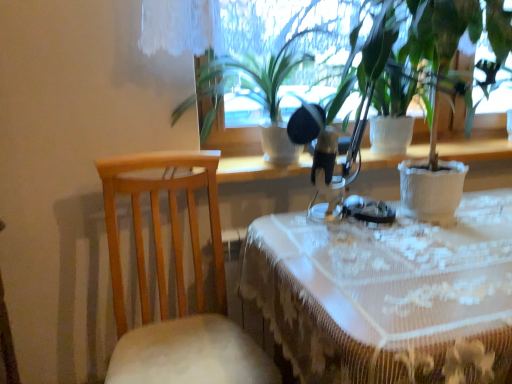
Describe the element at coordinates (400, 64) in the screenshot. Image resolution: width=512 pixels, height=384 pixels. I see `white textured pot at center, marked as the second houseplant in a left-to-right arrangement` at that location.

Where is `green matte plant at center, which appears as the 2th houseplant when viewed from the right`? The height and width of the screenshot is (384, 512). green matte plant at center, which appears as the 2th houseplant when viewed from the right is located at coordinates (278, 74).

This screenshot has width=512, height=384. In order to click on light wood chair at left in this screenshot , I will do `click(176, 284)`.

Is white textured pot at center, marked as the second houseplant in a left-to-right arrangement, positioned far away from light wood chair at left?

Actually, white textured pot at center, marked as the second houseplant in a left-to-right arrangement, and light wood chair at left are a little close together.

Identify the location of the 1st houseplant behind the light wood chair at left. (400, 64).

What's the angular difference between white textured pot at center, marked as the second houseplant in a left-to-right arrangement, and light wood chair at left's facing directions?

8.98 degrees.

From the image's perspective, relative to light wood chair at left, is white textured pot at center, marked as the second houseplant in a left-to-right arrangement, above or below?

white textured pot at center, marked as the second houseplant in a left-to-right arrangement, is situated higher than light wood chair at left in the image.

From a real-world perspective, is light wood chair at left beneath green matte plant at center, the 1th houseplant when ordered from left to right?

Indeed, from a real-world perspective, light wood chair at left is positioned beneath green matte plant at center, the 1th houseplant when ordered from left to right.

Could you tell me if light wood chair at left is facing green matte plant at center, the 1th houseplant when ordered from left to right?

No.

From the image's perspective, is light wood chair at left on green matte plant at center, which appears as the 2th houseplant when viewed from the right?

Actually, light wood chair at left appears below green matte plant at center, which appears as the 2th houseplant when viewed from the right, in the image.

Does light wood chair at left have a smaller size compared to green matte plant at center, the 1th houseplant when ordered from left to right?

No, light wood chair at left is not smaller than green matte plant at center, the 1th houseplant when ordered from left to right.

Considering the sizes of white textured pot at center, marked as the second houseplant in a left-to-right arrangement, and white lace tablecloth at center in the image, is white textured pot at center, marked as the second houseplant in a left-to-right arrangement, taller or shorter than white lace tablecloth at center?

→ Clearly, white textured pot at center, marked as the second houseplant in a left-to-right arrangement, is shorter compared to white lace tablecloth at center.

Is point (216, 77) in front of point (349, 233)?

No.

In the scene shown: Can you confirm if white textured pot at center, placed as the first houseplant when sorted from right to left, is positioned to the left of white lace tablecloth at center?

Indeed, white textured pot at center, placed as the first houseplant when sorted from right to left, is positioned on the left side of white lace tablecloth at center.

Does white textured pot at center, marked as the second houseplant in a left-to-right arrangement, have a larger size compared to white lace tablecloth at center?

No.

From a real-world perspective, is white lace tablecloth at center located beneath white textured pot at center, marked as the second houseplant in a left-to-right arrangement?

Yes, from a real-world perspective, white lace tablecloth at center is under white textured pot at center, marked as the second houseplant in a left-to-right arrangement.

Which is farther, (412,333) or (399,53)?

Point (399,53)

Considering the positions of objects white lace tablecloth at center and white textured pot at center, placed as the first houseplant when sorted from right to left, in the image provided, who is more to the right, white lace tablecloth at center or white textured pot at center, placed as the first houseplant when sorted from right to left,?

Positioned to the right is white lace tablecloth at center.

Considering the sizes of objects white lace tablecloth at center and white textured pot at center, marked as the second houseplant in a left-to-right arrangement, in the image provided, who is taller, white lace tablecloth at center or white textured pot at center, marked as the second houseplant in a left-to-right arrangement,?

With more height is white lace tablecloth at center.

Where is `chair in front of the green matte plant at center, the 1th houseplant when ordered from left to right`? This screenshot has height=384, width=512. chair in front of the green matte plant at center, the 1th houseplant when ordered from left to right is located at coordinates (176, 284).

From a real-world perspective, is green matte plant at center, which appears as the 2th houseplant when viewed from the right, below light wood chair at left?

→ No, from a real-world perspective, green matte plant at center, which appears as the 2th houseplant when viewed from the right, is not below light wood chair at left.

Is green matte plant at center, the 1th houseplant when ordered from left to right, far from light wood chair at left?

No, green matte plant at center, the 1th houseplant when ordered from left to right, is in close proximity to light wood chair at left.

Would you say green matte plant at center, which appears as the 2th houseplant when viewed from the right, contains white lace tablecloth at center?

No, white lace tablecloth at center is not a part of green matte plant at center, which appears as the 2th houseplant when viewed from the right.

Is point (270, 149) closer to viewer compared to point (322, 346)?

No, (270, 149) is further to viewer.

In terms of height, does green matte plant at center, which appears as the 2th houseplant when viewed from the right, look taller or shorter compared to white lace tablecloth at center?

Considering their sizes, green matte plant at center, which appears as the 2th houseplant when viewed from the right, has less height than white lace tablecloth at center.

Which of these two, green matte plant at center, the 1th houseplant when ordered from left to right, or white lace tablecloth at center, is wider?

Wider between the two is white lace tablecloth at center.

Considering the sizes of light wood chair at left and white textured pot at center, placed as the first houseplant when sorted from right to left, in the image, is light wood chair at left bigger or smaller than white textured pot at center, placed as the first houseplant when sorted from right to left,?

Considering their sizes, light wood chair at left takes up more space than white textured pot at center, placed as the first houseplant when sorted from right to left.

The image size is (512, 384). I want to click on the 2nd houseplant located above the light wood chair at left (from a real-world perspective), so click(400, 64).

How different are the orientations of light wood chair at left and white textured pot at center, placed as the first houseplant when sorted from right to left, in degrees?

light wood chair at left and white textured pot at center, placed as the first houseplant when sorted from right to left, are facing 8.98 degrees away from each other.

Could you tell me if light wood chair at left is facing white textured pot at center, marked as the second houseplant in a left-to-right arrangement?

No, light wood chair at left is not facing towards white textured pot at center, marked as the second houseplant in a left-to-right arrangement.

This screenshot has width=512, height=384. In order to click on houseplant that is the 2nd one when counting rightward from the light wood chair at left in this screenshot , I will do `click(400, 64)`.

Identify the location of chair below the green matte plant at center, which appears as the 2th houseplant when viewed from the right (from the image's perspective). This screenshot has width=512, height=384. (176, 284).

Looking at this image, based on their spatial positions, is green matte plant at center, the 1th houseplant when ordered from left to right, or white lace tablecloth at center closer to white textured pot at center, marked as the second houseplant in a left-to-right arrangement?

green matte plant at center, the 1th houseplant when ordered from left to right, is closer to white textured pot at center, marked as the second houseplant in a left-to-right arrangement.

Looking at the image, which one is located further to white textured pot at center, placed as the first houseplant when sorted from right to left, green matte plant at center, which appears as the 2th houseplant when viewed from the right, or light wood chair at left?

Based on the image, light wood chair at left appears to be further to white textured pot at center, placed as the first houseplant when sorted from right to left.

Estimate the real-world distances between objects in this image. Which object is closer to light wood chair at left, green matte plant at center, the 1th houseplant when ordered from left to right, or white textured pot at center, marked as the second houseplant in a left-to-right arrangement?

green matte plant at center, the 1th houseplant when ordered from left to right.

Looking at the image, which one is located closer to white lace tablecloth at center, green matte plant at center, which appears as the 2th houseplant when viewed from the right, or light wood chair at left?

light wood chair at left.

Based on their spatial positions, is light wood chair at left or green matte plant at center, which appears as the 2th houseplant when viewed from the right, closer to white textured pot at center, placed as the first houseplant when sorted from right to left?

Among the two, green matte plant at center, which appears as the 2th houseplant when viewed from the right, is located nearer to white textured pot at center, placed as the first houseplant when sorted from right to left.

Estimate the real-world distances between objects in this image. Which object is further from white lace tablecloth at center, light wood chair at left or white textured pot at center, placed as the first houseplant when sorted from right to left?

white textured pot at center, placed as the first houseplant when sorted from right to left, is positioned further to the anchor white lace tablecloth at center.

Estimate the real-world distances between objects in this image. Which object is closer to white lace tablecloth at center, white textured pot at center, marked as the second houseplant in a left-to-right arrangement, or green matte plant at center, which appears as the 2th houseplant when viewed from the right?

white textured pot at center, marked as the second houseplant in a left-to-right arrangement, lies closer to white lace tablecloth at center than the other object.

From the image, which object appears to be nearer to light wood chair at left, green matte plant at center, the 1th houseplant when ordered from left to right, or white lace tablecloth at center?

Based on the image, white lace tablecloth at center appears to be nearer to light wood chair at left.

Where is `houseplant between light wood chair at left and white textured pot at center, marked as the second houseplant in a left-to-right arrangement`? houseplant between light wood chair at left and white textured pot at center, marked as the second houseplant in a left-to-right arrangement is located at coordinates (278, 74).

This screenshot has width=512, height=384. I want to click on houseplant between green matte plant at center, which appears as the 2th houseplant when viewed from the right, and white lace tablecloth at center vertically, so click(x=400, y=64).